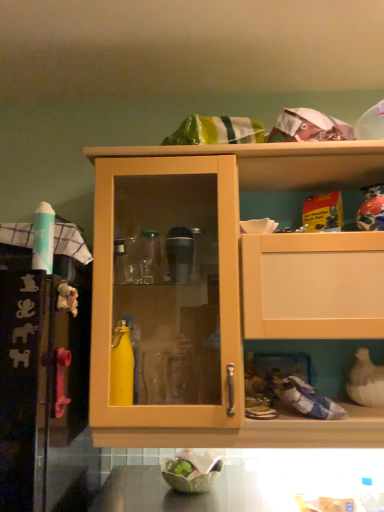
Question: Is matte wood cabinet at center outside of smooth dark brown countertop at lower center?

Choices:
 (A) no
 (B) yes

Answer: (B)

Question: Does matte wood cabinet at center contain smooth dark brown countertop at lower center?

Choices:
 (A) yes
 (B) no

Answer: (B)

Question: Is matte wood cabinet at center next to smooth dark brown countertop at lower center?

Choices:
 (A) yes
 (B) no

Answer: (B)

Question: Does matte wood cabinet at center appear on the left side of smooth dark brown countertop at lower center?

Choices:
 (A) yes
 (B) no

Answer: (B)

Question: Is matte wood cabinet at center closer to camera compared to smooth dark brown countertop at lower center?

Choices:
 (A) no
 (B) yes

Answer: (A)

Question: Considering the relative sizes of matte wood cabinet at center and smooth dark brown countertop at lower center in the image provided, is matte wood cabinet at center shorter than smooth dark brown countertop at lower center?

Choices:
 (A) yes
 (B) no

Answer: (B)

Question: From the image's perspective, is smooth dark brown countertop at lower center above green leafy material bowl at lower center?

Choices:
 (A) yes
 (B) no

Answer: (B)

Question: Is smooth dark brown countertop at lower center oriented away from green leafy material bowl at lower center?

Choices:
 (A) yes
 (B) no

Answer: (B)

Question: Are smooth dark brown countertop at lower center and green leafy material bowl at lower center making contact?

Choices:
 (A) yes
 (B) no

Answer: (B)

Question: Does smooth dark brown countertop at lower center have a lesser height compared to green leafy material bowl at lower center?

Choices:
 (A) yes
 (B) no

Answer: (B)

Question: Is smooth dark brown countertop at lower center behind green leafy material bowl at lower center?

Choices:
 (A) no
 (B) yes

Answer: (A)

Question: Is smooth dark brown countertop at lower center not inside green leafy material bowl at lower center?

Choices:
 (A) no
 (B) yes

Answer: (B)

Question: From the image's perspective, would you say green leafy material bowl at lower center is shown under smooth dark brown countertop at lower center?

Choices:
 (A) no
 (B) yes

Answer: (A)